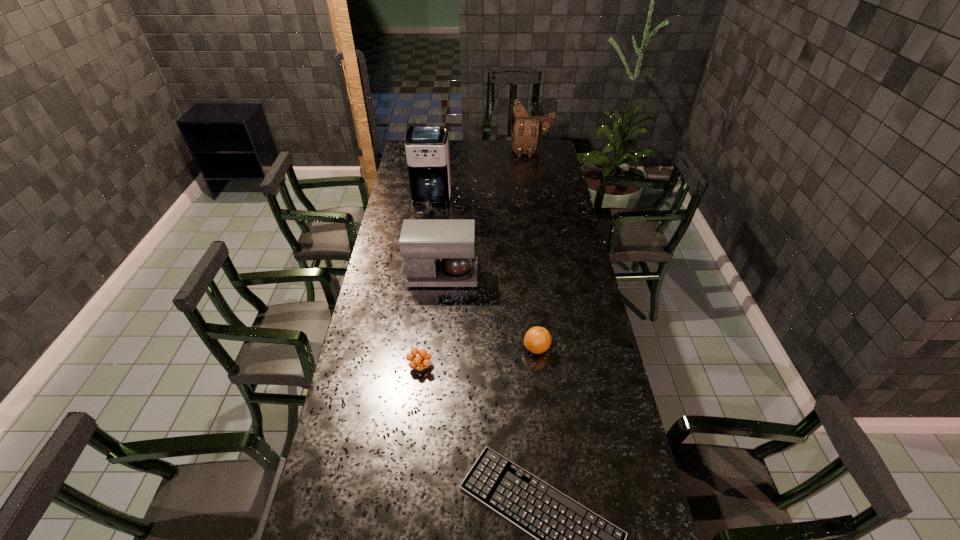
Identify the location of vacant space located on the front panel of the tallest object. The image size is (960, 540). (426, 240).

At what (x,y) coordinates should I click in order to perform the action: click on vacant space located on the front-facing side of the farthest object. Please return your answer as a coordinate pair (x, y). Image resolution: width=960 pixels, height=540 pixels. Looking at the image, I should click on (535, 171).

The width and height of the screenshot is (960, 540). What are the coordinates of `vacant space located 0.380m on the carafe side of the shorter coffee maker` in the screenshot? It's located at (572, 275).

Where is `vacant point located 0.130m on the left of the taller orange fruit`? This screenshot has height=540, width=960. vacant point located 0.130m on the left of the taller orange fruit is located at coordinates (485, 348).

The width and height of the screenshot is (960, 540). Identify the location of free space located 0.130m on the right of the left orange fruit. (474, 366).

Identify the location of object located in the far edge section of the desktop. This screenshot has width=960, height=540. (527, 130).

This screenshot has width=960, height=540. I want to click on object situated at the right edge, so click(x=527, y=130).

Where is `object that is at the far right corner`? This screenshot has height=540, width=960. object that is at the far right corner is located at coordinates (527, 130).

I want to click on vacant space at the far edge of the desktop, so (452, 152).

At what (x,y) coordinates should I click in order to perform the action: click on vacant space at the left edge of the desktop. Please return your answer as a coordinate pair (x, y). The height and width of the screenshot is (540, 960). Looking at the image, I should click on (388, 375).